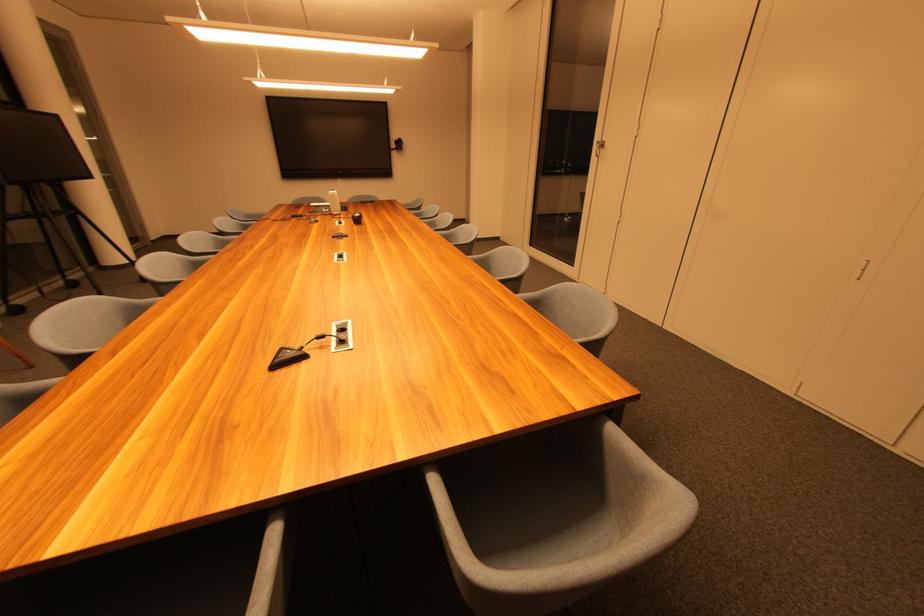
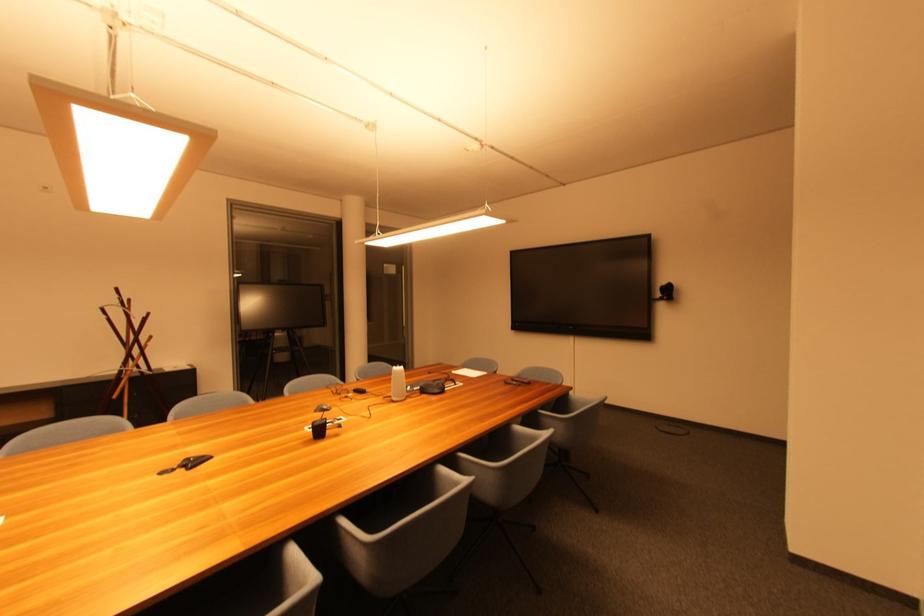
The point at (337,196) is marked in the first image. Where is the corresponding point in the second image?

(399, 373)